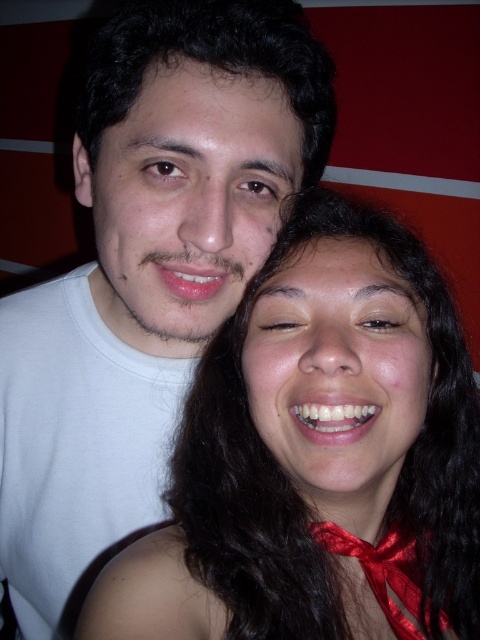
Who is higher up, smooth skin face at center or shiny red bow tie at lower right?

Positioned higher is smooth skin face at center.

Can you confirm if smooth skin face at center is positioned above shiny red bow tie at lower right?

Yes.

Between point (340, 420) and point (411, 624), which one is positioned behind?

Positioned behind is point (411, 624).

Locate an element on the screen. Image resolution: width=480 pixels, height=640 pixels. smooth skin face at center is located at coordinates (319, 456).

Is smooth skin face at center in front of white matte t-shirt at center?

Yes, it is in front of white matte t-shirt at center.

Who is more distant from viewer, (286, 534) or (168, 104)?

The point (286, 534) is behind.

Image resolution: width=480 pixels, height=640 pixels. What are the coordinates of `smooth skin face at center` in the screenshot? It's located at pos(319,456).

Which of these two, white matte t-shirt at center or shiny red bow tie at lower right, stands taller?

white matte t-shirt at center is taller.

Which is above, white matte t-shirt at center or shiny red bow tie at lower right?

white matte t-shirt at center is higher up.

Identify the location of white matte t-shirt at center. The height and width of the screenshot is (640, 480). (146, 273).